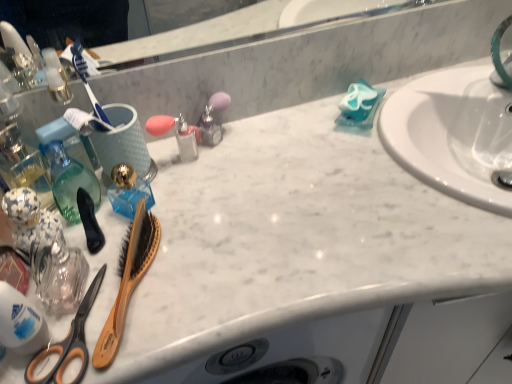
Identify the location of vacant area that lies between blue matte soap at upper right, acting as the 2th cleaning product starting from the front, and translucent glass bottle at left. (253, 153).